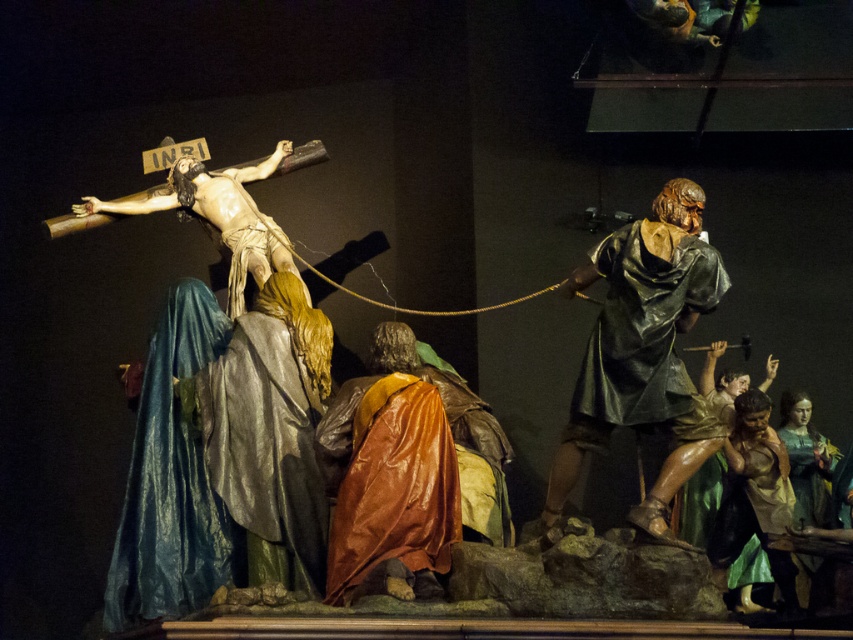
Where is `shiny bronze helmet at right`? shiny bronze helmet at right is located at coordinates (643, 353).

Identify the location of shiny bronze helmet at right. (643, 353).

Is brown leather robe at center smaller than smooth green fabric at lower right?

No.

From the picture: Which of these two, brown leather robe at center or smooth green fabric at lower right, stands taller?

Standing taller between the two is brown leather robe at center.

This screenshot has height=640, width=853. Describe the element at coordinates (387, 468) in the screenshot. I see `brown leather robe at center` at that location.

In order to click on brown leather robe at center in this screenshot , I will do `click(387, 468)`.

Which of these two, smooth wood crucifix at upper left or brown leather robe at lower right, stands taller?

With more height is brown leather robe at lower right.

How far apart are smooth wood crucifix at upper left and brown leather robe at lower right?

The distance of smooth wood crucifix at upper left from brown leather robe at lower right is 113.67 feet.

Which is in front, point (282, 236) or point (769, 464)?

Point (769, 464) is more forward.

Find the location of a particular element. Image resolution: width=853 pixels, height=640 pixels. smooth wood crucifix at upper left is located at coordinates (219, 216).